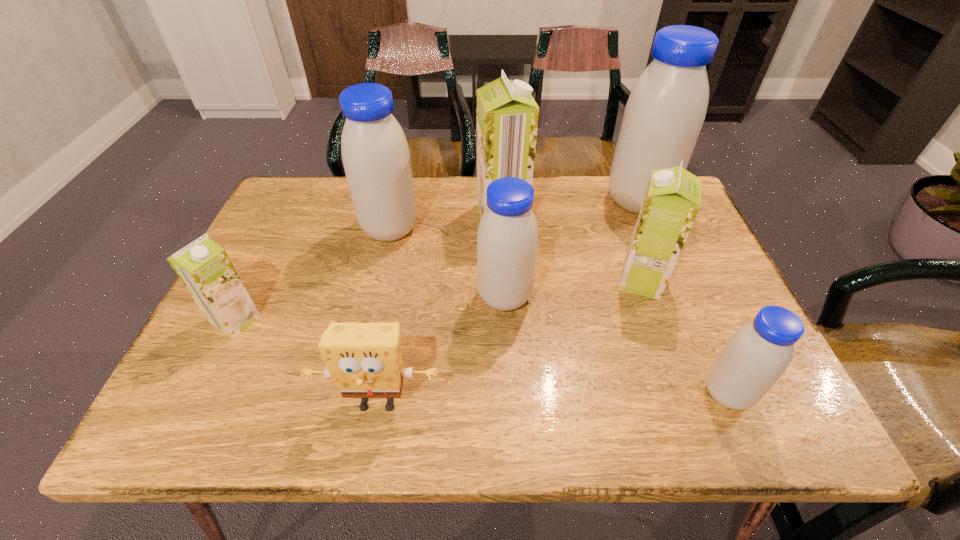
Image resolution: width=960 pixels, height=540 pixels. I want to click on the sixth closest object relative to the sponge, so click(x=758, y=353).

Point out which soya milk is positioned as the nearest to the second smallest blue soya milk. Please provide its 2D coordinates. Your answer should be formatted as a tuple, i.e. [(x, y)], where the tuple contains the x and y coordinates of a point satisfying the conditions above.

[(507, 115)]

You are a GUI agent. You are given a task and a screenshot of the screen. Output one action in this format:
    pyautogui.click(x=<x>, y=<y>)
    Task: Click on the fifth closest soya milk to the leftmost object
    The height and width of the screenshot is (540, 960).
    Given the screenshot: What is the action you would take?
    pyautogui.click(x=663, y=117)

Where is `the third closest blue soya milk relative to the second green soya milk from left to right`? The width and height of the screenshot is (960, 540). the third closest blue soya milk relative to the second green soya milk from left to right is located at coordinates (663, 117).

At what (x,y) coordinates should I click in order to perform the action: click on the third closest blue soya milk relative to the leftmost green soya milk. Please return your answer as a coordinate pair (x, y). This screenshot has height=540, width=960. Looking at the image, I should click on (663, 117).

The width and height of the screenshot is (960, 540). Find the location of `green soya milk that stands as the third closest to the sponge`. green soya milk that stands as the third closest to the sponge is located at coordinates (507, 115).

Locate which green soya milk is the second closest to the sixth soya milk from right to left. Please provide its 2D coordinates. Your answer should be formatted as a tuple, i.e. [(x, y)], where the tuple contains the x and y coordinates of a point satisfying the conditions above.

[(203, 266)]

The width and height of the screenshot is (960, 540). In order to click on free space that satisfies the following two spatial constraints: 1. on the front side of the nearest blue soya milk; 2. on the right side of the smallest green soya milk in this screenshot , I will do `click(201, 393)`.

Where is `free space that satisfies the following two spatial constraints: 1. on the front side of the second soya milk from left to right; 2. on the right side of the nearest blue soya milk`? free space that satisfies the following two spatial constraints: 1. on the front side of the second soya milk from left to right; 2. on the right side of the nearest blue soya milk is located at coordinates (353, 393).